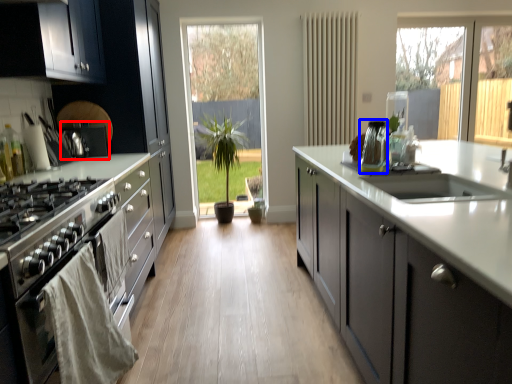
Question: Which point is closer to the camera, appliance (highlighted by a red box) or appliance (highlighted by a blue box)?

Choices:
 (A) appliance
 (B) appliance

Answer: (B)